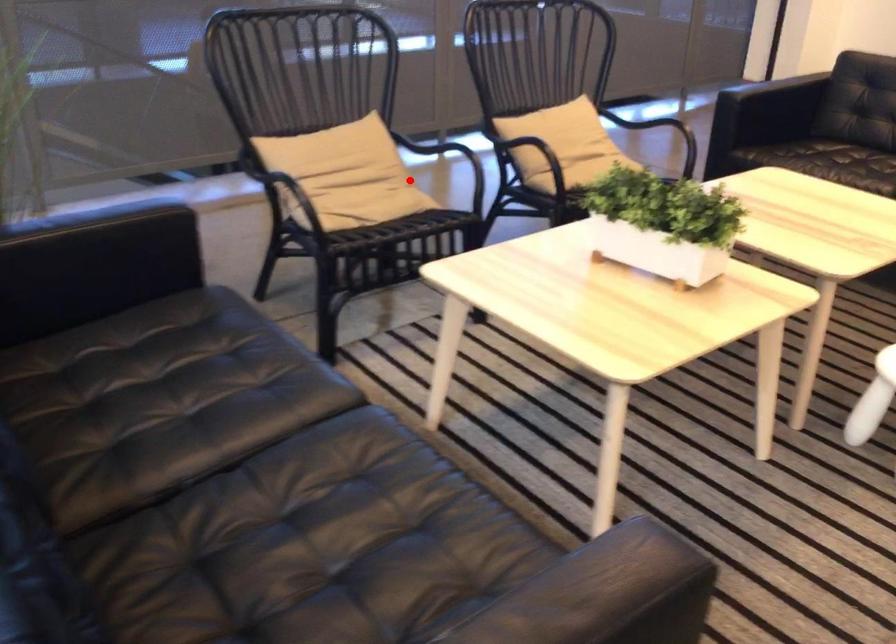
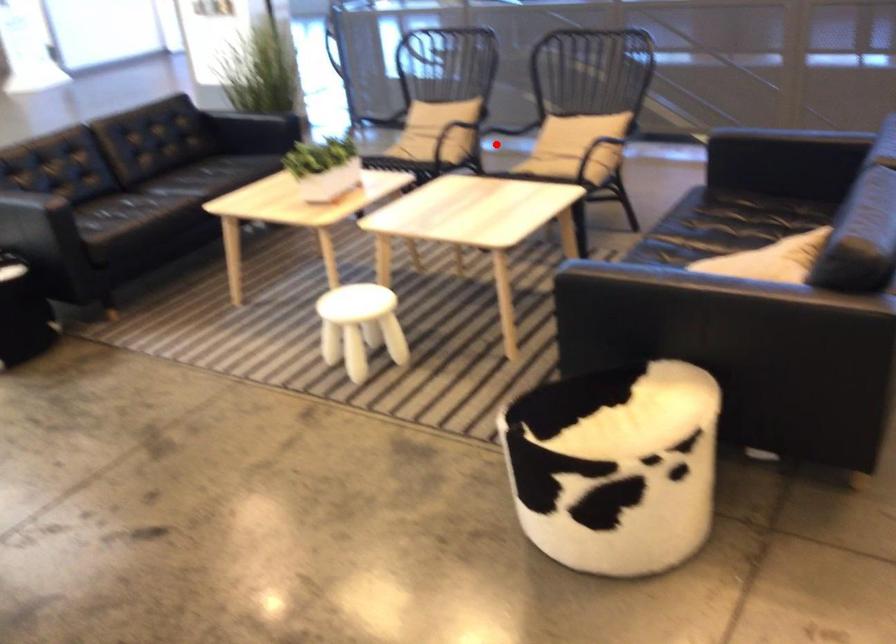
I am providing you with two images of the same scene from different viewpoints. A red point is marked on the first image and another point is marked on the second image. Do the highlighted points in image1 and image2 indicate the same real-world spot?

No